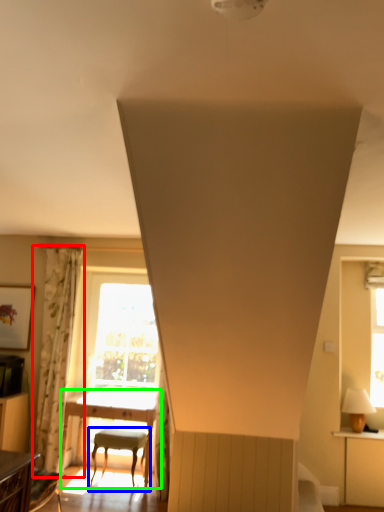
Question: Which object is the closest to the curtain (highlighted by a red box)? Choose among these: chair (highlighted by a blue box) or table (highlighted by a green box).

Choices:
 (A) chair
 (B) table

Answer: (B)